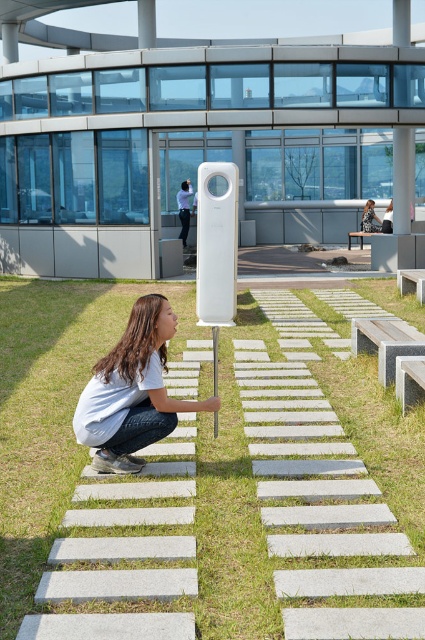
Question: From the image, what is the correct spatial relationship of granite bench at lower right in relation to matte white phone at center?

Choices:
 (A) right
 (B) left

Answer: (B)

Question: Does green grass at center appear over matte white phone at center?

Choices:
 (A) yes
 (B) no

Answer: (B)

Question: Which point is farther to the camera?

Choices:
 (A) tap(149, 420)
 (B) tap(371, 228)
 (C) tap(397, 220)

Answer: (B)

Question: Among these objects, which one is farthest from the camera?

Choices:
 (A) white glossy pillar at upper center
 (B) granite bench at lower right

Answer: (A)

Question: Can you confirm if gray concrete bench at center is smaller than white wooden bench at center?

Choices:
 (A) yes
 (B) no

Answer: (B)

Question: Which of the following is the farthest from the observer?

Choices:
 (A) matte white phone at center
 (B) white glossy pillar at upper center
 (C) gray concrete bench at center

Answer: (A)